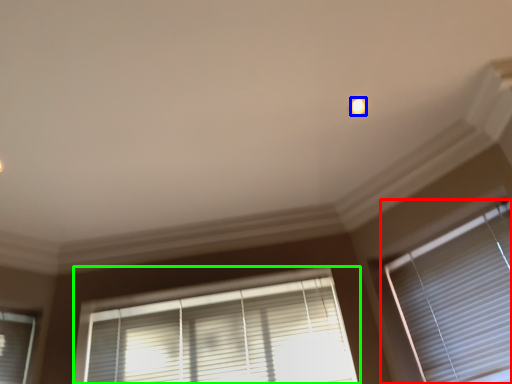
Question: Which is farther away from window blind (highlighted by a red box)? light (highlighted by a blue box) or window blind (highlighted by a green box)?

Choices:
 (A) light
 (B) window blind

Answer: (A)